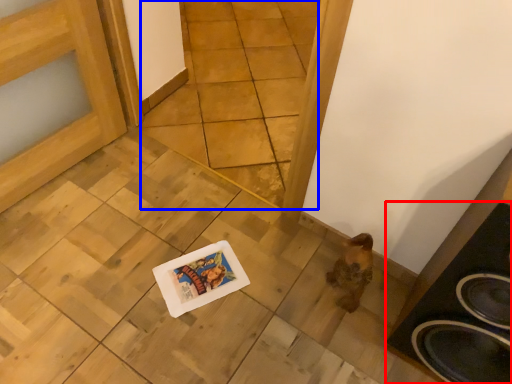
Question: Which of the following is the farthest to the observer, speaker (highlighted by a red box) or tile (highlighted by a blue box)?

Choices:
 (A) speaker
 (B) tile

Answer: (B)